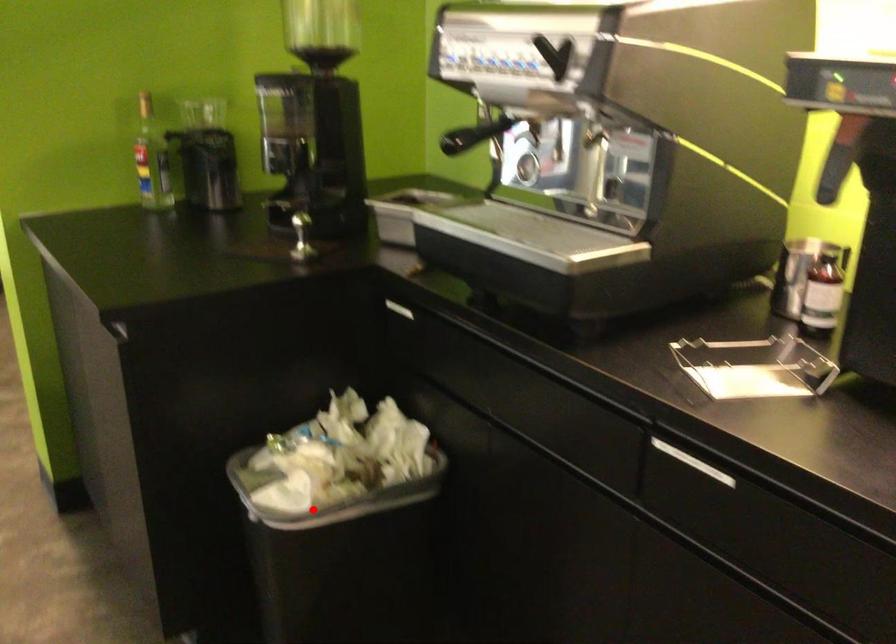
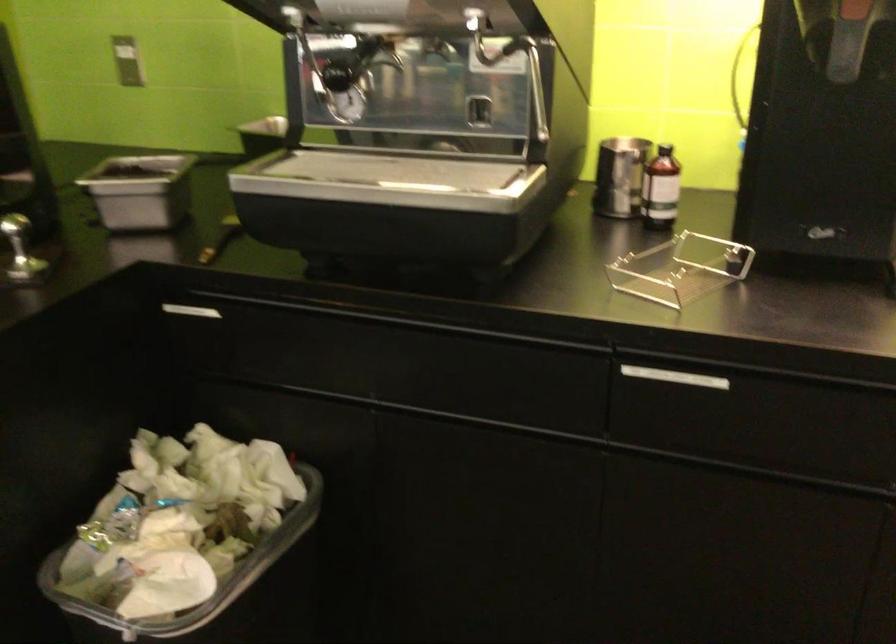
Where in the second image is the point corresponding to the highlighted location from the first image?

(218, 592)